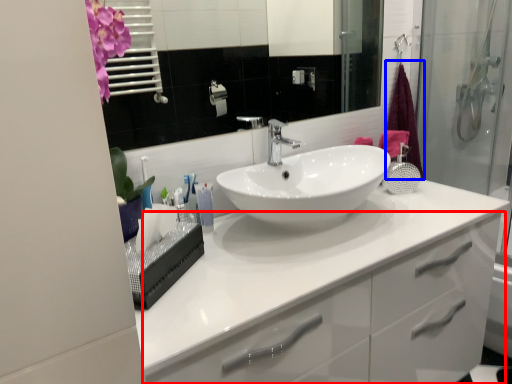
Question: Which of the following is the farthest to the observer, bathroom cabinet (highlighted by a red box) or shower curtain (highlighted by a blue box)?

Choices:
 (A) bathroom cabinet
 (B) shower curtain

Answer: (B)